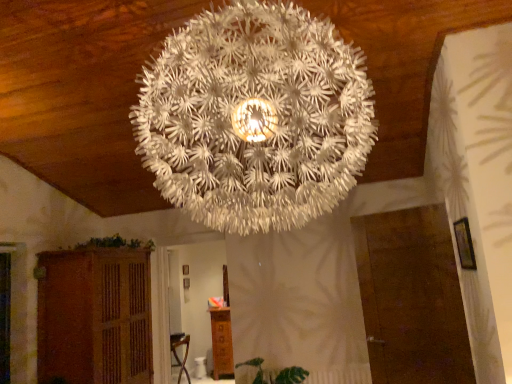
Question: From a real-world perspective, does wooden cabinet at lower center, which is the second furniture in left-to-right order, sit lower than brown wooden cabinet at lower left, the first furniture from the front?

Choices:
 (A) yes
 (B) no

Answer: (A)

Question: Is wooden cabinet at lower center, which is counted as the 2th furniture, starting from the front, positioned before brown wooden cabinet at lower left, which appears as the 2th furniture when viewed from the back?

Choices:
 (A) no
 (B) yes

Answer: (A)

Question: Considering the relative sizes of wooden cabinet at lower center, which is the 1th furniture in right-to-left order, and brown wooden cabinet at lower left, the 1th furniture viewed from the left, in the image provided, is wooden cabinet at lower center, which is the 1th furniture in right-to-left order, shorter than brown wooden cabinet at lower left, the 1th furniture viewed from the left,?

Choices:
 (A) no
 (B) yes

Answer: (B)

Question: From a real-world perspective, does wooden cabinet at lower center, which is counted as the first furniture, starting from the back, stand above brown wooden cabinet at lower left, the 1th furniture viewed from the left?

Choices:
 (A) yes
 (B) no

Answer: (B)

Question: Can you confirm if wooden cabinet at lower center, which is the 1th furniture in right-to-left order, is thinner than brown wooden cabinet at lower left, the first furniture from the front?

Choices:
 (A) no
 (B) yes

Answer: (B)

Question: Considering the relative positions of wooden cabinet at lower center, which is the second furniture in left-to-right order, and brown wooden cabinet at lower left, acting as the second furniture starting from the right, in the image provided, is wooden cabinet at lower center, which is the second furniture in left-to-right order, behind brown wooden cabinet at lower left, acting as the second furniture starting from the right,?

Choices:
 (A) no
 (B) yes

Answer: (B)

Question: Is green leafy plant at lower center, the 1th plant when ordered from bottom to top, not within wooden cabinet at lower center, which is the 1th furniture in right-to-left order?

Choices:
 (A) yes
 (B) no

Answer: (A)

Question: Is green leafy plant at lower center, marked as the 1th plant in a right-to-left arrangement, at the left side of wooden cabinet at lower center, which is counted as the first furniture, starting from the back?

Choices:
 (A) no
 (B) yes

Answer: (A)

Question: Is green leafy plant at lower center, the 1th plant when ordered from bottom to top, aimed at wooden cabinet at lower center, which is the second furniture in left-to-right order?

Choices:
 (A) no
 (B) yes

Answer: (A)

Question: From a real-world perspective, is green leafy plant at lower center, the 2th plant positioned from the left, physically below wooden cabinet at lower center, which is counted as the first furniture, starting from the back?

Choices:
 (A) no
 (B) yes

Answer: (A)

Question: Does green leafy plant at lower center, marked as the 1th plant in a right-to-left arrangement, have a larger size compared to wooden cabinet at lower center, which is counted as the 2th furniture, starting from the front?

Choices:
 (A) no
 (B) yes

Answer: (A)

Question: From the image's perspective, would you say green leafy plant at lower center, the 2th plant positioned from the left, is shown under wooden cabinet at lower center, which is the second furniture in left-to-right order?

Choices:
 (A) no
 (B) yes

Answer: (A)

Question: Can you confirm if wooden cabinet at lower center, which is the second furniture in left-to-right order, is thinner than green leafy plant at lower left, the first plant from the left?

Choices:
 (A) yes
 (B) no

Answer: (A)